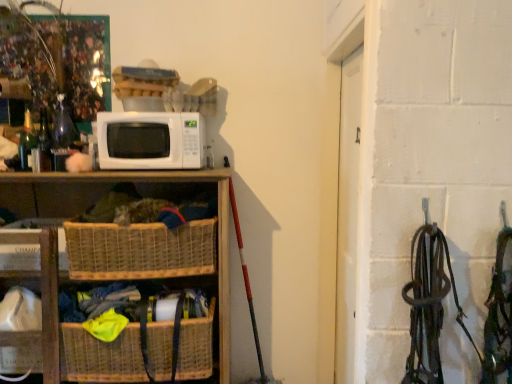
Question: From the image's perspective, would you say woven wood shelf at lower left, which ranks as the 2th shelf in left-to-right order, is shown under white matte microwave at center?

Choices:
 (A) no
 (B) yes

Answer: (B)

Question: Does woven wood shelf at lower left, which is the first shelf from right to left, have a greater height compared to white matte microwave at center?

Choices:
 (A) yes
 (B) no

Answer: (A)

Question: Is woven wood shelf at lower left, which ranks as the 2th shelf in left-to-right order, positioned with its back to white matte microwave at center?

Choices:
 (A) no
 (B) yes

Answer: (A)

Question: Is the position of woven wood shelf at lower left, which is the first shelf from right to left, more distant than that of white matte microwave at center?

Choices:
 (A) no
 (B) yes

Answer: (A)

Question: From a real-world perspective, is woven wood shelf at lower left, which is the first shelf from right to left, located higher than white matte microwave at center?

Choices:
 (A) no
 (B) yes

Answer: (A)

Question: Considering their positions, is woven brown basket at lower center, the 1th basket from the bottom, located in front of or behind woven brown basket at lower left, which is the first basket in top-to-bottom order?

Choices:
 (A) behind
 (B) front

Answer: (A)

Question: Is woven brown basket at lower center, the 1th basket from the bottom, inside the boundaries of woven brown basket at lower left, which is the 2th basket from bottom to top, or outside?

Choices:
 (A) outside
 (B) inside

Answer: (A)

Question: From the image's perspective, relative to woven brown basket at lower left, which is the first basket in top-to-bottom order, is woven brown basket at lower center, the 1th basket from the bottom, above or below?

Choices:
 (A) below
 (B) above

Answer: (A)

Question: From a real-world perspective, is woven brown basket at lower center, the 1th basket from the bottom, above or below woven brown basket at lower left, which is the 2th basket from bottom to top?

Choices:
 (A) below
 (B) above

Answer: (A)

Question: In the image, is woven brown basket at lower left, which is the first basket in top-to-bottom order, on the left side or the right side of white matte microwave at center?

Choices:
 (A) right
 (B) left

Answer: (B)

Question: Is woven brown basket at lower left, which is the first basket in top-to-bottom order, inside or outside of white matte microwave at center?

Choices:
 (A) outside
 (B) inside

Answer: (A)

Question: Does point (194, 264) appear closer or farther from the camera than point (141, 117)?

Choices:
 (A) farther
 (B) closer

Answer: (B)

Question: From the image's perspective, relative to white matte microwave at center, is woven brown basket at lower left, which is the 2th basket from bottom to top, above or below?

Choices:
 (A) above
 (B) below

Answer: (B)

Question: In terms of height, does green glass bottle at left look taller or shorter compared to woven wood basket at lower left, the first shelf from the left?

Choices:
 (A) short
 (B) tall

Answer: (A)

Question: Is green glass bottle at left inside or outside of woven wood basket at lower left, the first shelf from the left?

Choices:
 (A) inside
 (B) outside

Answer: (B)